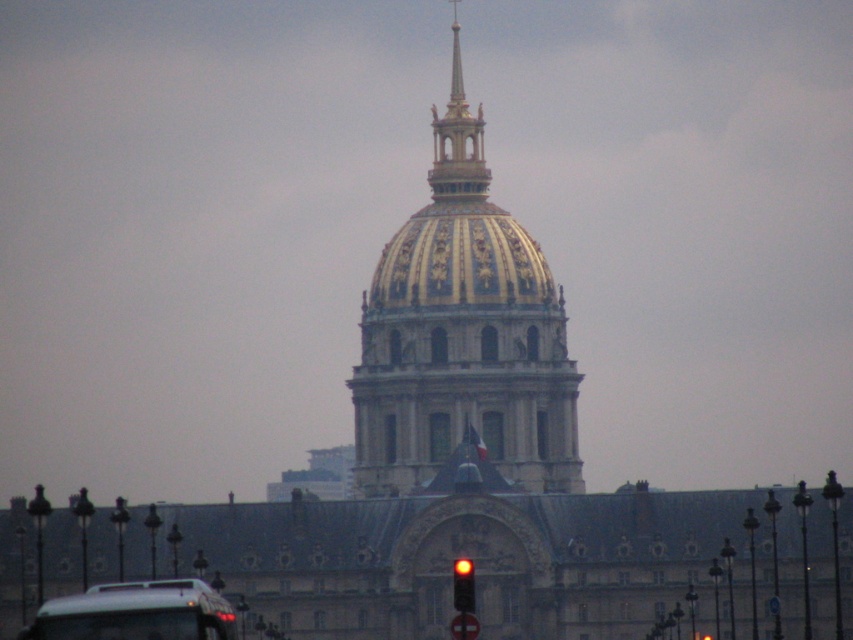
You are a delivery person who needs to drive the white matte bus at lower left under the red glass traffic light at center. Is the height of the bus a concern for passing under the traffic light?

The white matte bus at lower left is much taller than the red glass traffic light at center, so driving the white matte bus at lower left under the red glass traffic light at center would not be possible due to height restrictions.